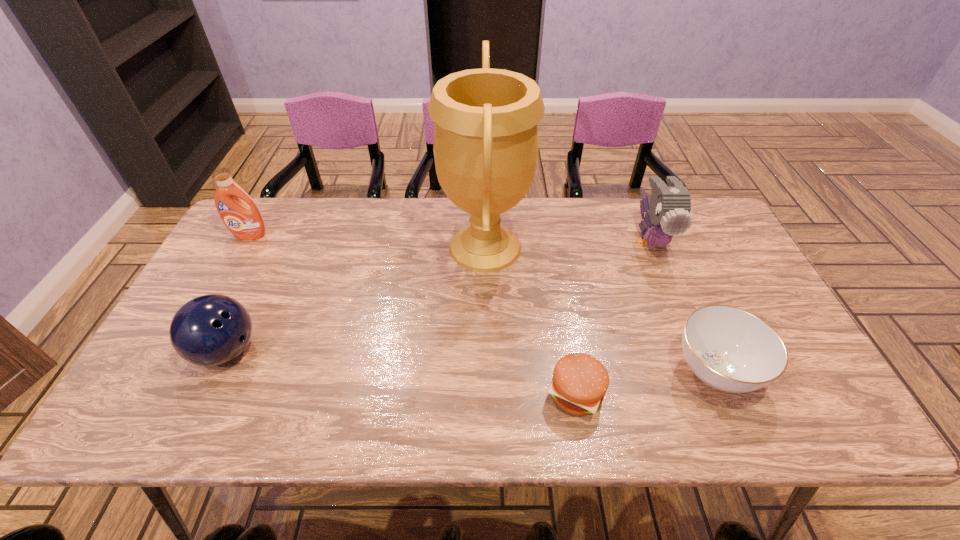
This screenshot has height=540, width=960. I want to click on the tallest object, so click(485, 147).

Find the location of a particular element. The image size is (960, 540). detergent is located at coordinates (243, 219).

In order to click on bird in this screenshot , I will do `click(668, 209)`.

This screenshot has width=960, height=540. In order to click on bowling ball in this screenshot , I will do `click(209, 330)`.

The height and width of the screenshot is (540, 960). What are the coordinates of `the second shortest object` in the screenshot? It's located at (729, 349).

I want to click on hamburger, so click(x=580, y=381).

The height and width of the screenshot is (540, 960). I want to click on free point located on the engravings side of the trophy, so click(417, 247).

Where is `free space located 0.390m on the engravings side of the trophy`? The image size is (960, 540). free space located 0.390m on the engravings side of the trophy is located at coordinates (311, 247).

I want to click on vacant position located 0.360m on the engravings side of the trophy, so click(x=321, y=247).

The width and height of the screenshot is (960, 540). What are the coordinates of `blank space located on the front-facing side of the detergent` in the screenshot? It's located at (224, 283).